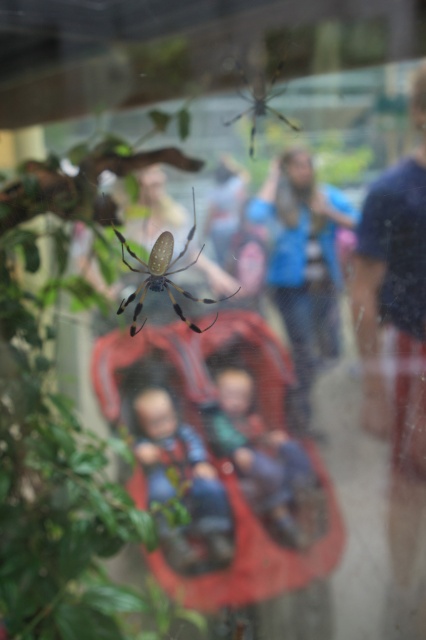
Looking at this image, you are holding a 3.5 feet long pole and want to reach the soft green fabric at center. Can you touch it without moving closer?

The soft green fabric at center and viewer are 4.50 feet apart from each other, so the pole is 3.5 feet long. The pole is shorter than the distance, so you cannot reach the soft green fabric at center.

You are a tailor trying to decide which fabric to use for a new jacket design. You have the blue fabric jacket at center and the soft green fabric at center in front of you. Which fabric has a smaller width that might be better for a tailored fit?

The blue fabric jacket at center has a lesser width compared to the soft green fabric at center, making it better suited for a tailored fit.